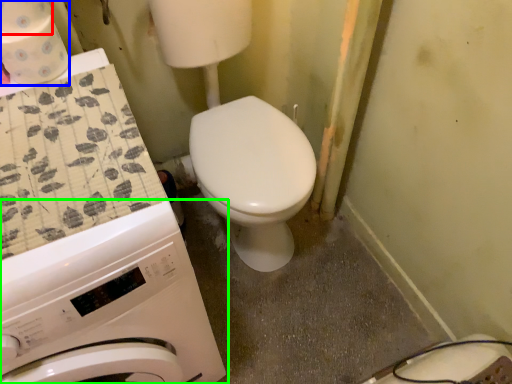
Question: Based on their relative distances, which object is nearer to toilet paper (highlighted by a red box)? Choose from toilet paper (highlighted by a blue box) and washing machine (highlighted by a green box).

Choices:
 (A) toilet paper
 (B) washing machine

Answer: (A)